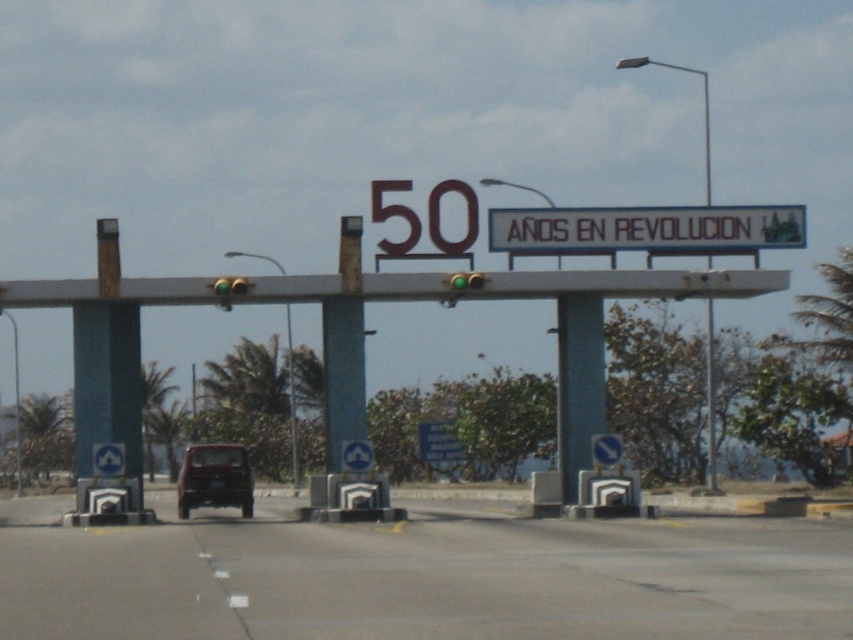
Can you confirm if metallic gray overpass at center is bigger than green glossy signpost at left?

Yes.

Can you confirm if metallic gray overpass at center is taller than green glossy signpost at left?

No, metallic gray overpass at center is not taller than green glossy signpost at left.

Does point (372, 284) lie behind point (99, 321)?

No, (372, 284) is in front of (99, 321).

I want to click on metallic gray overpass at center, so click(404, 288).

Is point (111, 433) closer to camera compared to point (335, 323)?

Yes.

Who is more distant from viewer, (131, 360) or (354, 432)?

Point (131, 360)

Locate an element on the screen. This screenshot has height=640, width=853. green glossy signpost at left is located at coordinates (107, 380).

Who is taller, white plastic sign at center or blue concrete pillar at center?

blue concrete pillar at center is taller.

Consider the image. Which is more to the left, white plastic sign at center or blue concrete pillar at center?

Positioned to the left is blue concrete pillar at center.

You are a GUI agent. You are given a task and a screenshot of the screen. Output one action in this format:
    pyautogui.click(x=<x>, y=<y>)
    Task: Click on the white plastic sign at center
    The width and height of the screenshot is (853, 640).
    Given the screenshot: What is the action you would take?
    pyautogui.click(x=646, y=228)